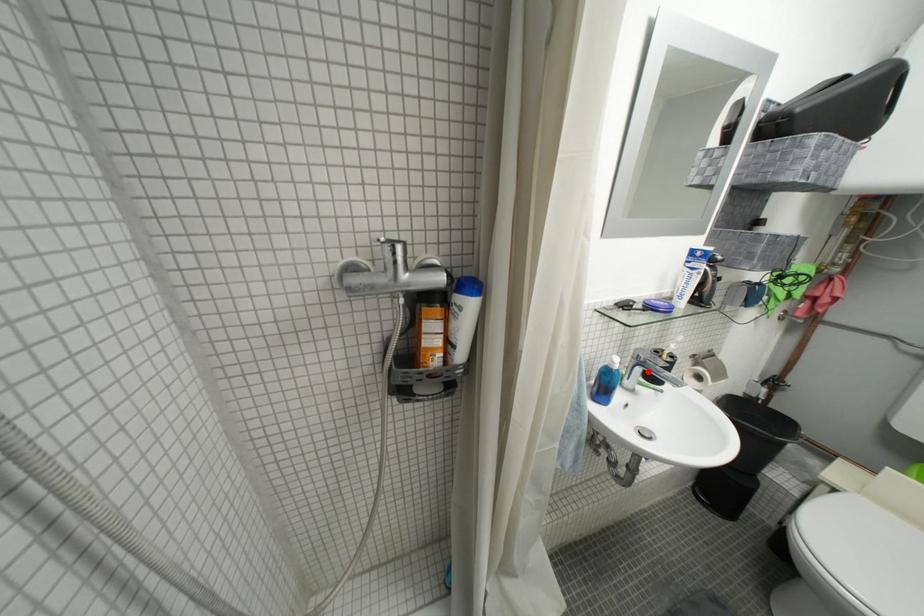
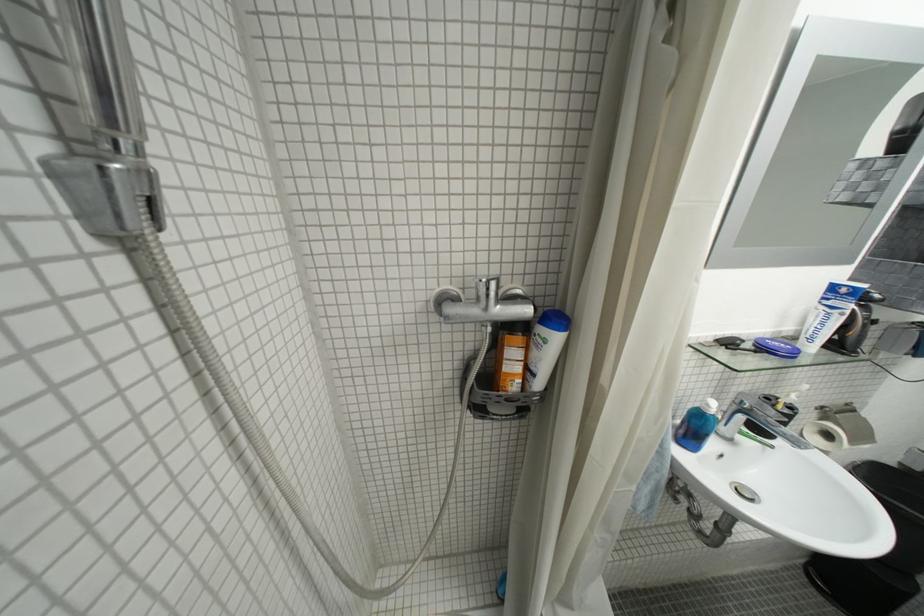
Where in the second image is the point corresponding to the highlighted location from the first image?

(749, 419)